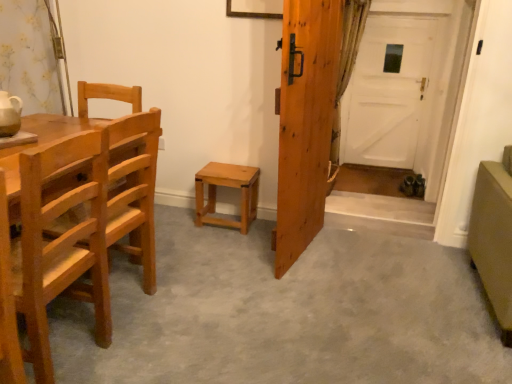
What do you see at coordinates (391, 89) in the screenshot?
I see `white matte door at center, arranged as the second door when viewed from the left` at bounding box center [391, 89].

What do you see at coordinates (305, 122) in the screenshot? The height and width of the screenshot is (384, 512). I see `wooden door at center, which is counted as the 1th door, starting from the left` at bounding box center [305, 122].

Image resolution: width=512 pixels, height=384 pixels. What are the coordinates of `green textured curtain at right` in the screenshot? It's located at coord(347,62).

In order to click on matte olive-green armchair at lower right in this screenshot , I will do `click(494, 237)`.

The height and width of the screenshot is (384, 512). Find the location of `white matte door at center, the first door viewed from the back`. white matte door at center, the first door viewed from the back is located at coordinates (391, 89).

Who is more distant, light brown wood stool at center or wooden door at center, which is counted as the 1th door, starting from the left?

light brown wood stool at center is more distant.

Is light brown wood stool at center shorter than wooden door at center, the 2th door when ordered from back to front?

Correct, light brown wood stool at center is not as tall as wooden door at center, the 2th door when ordered from back to front.

Measure the distance from light brown wood stool at center to wooden door at center, which is counted as the 1th door, starting from the left.

light brown wood stool at center and wooden door at center, which is counted as the 1th door, starting from the left, are 62.75 centimeters apart from each other.

Is light brown wood stool at center located outside wooden door at center, which appears as the 2th door when viewed from the right?

Yes.

Is light brown wood chair at left, the 2th chair viewed from the front, facing away from light brown wood chair at left, the 1th chair in the front-to-back sequence?

No, light brown wood chair at left, the 1th chair in the front-to-back sequence, is not at the back of light brown wood chair at left, the 2th chair viewed from the front.

Which object is closer to the camera taking this photo, light brown wood chair at left, the 2th chair viewed from the front, or light brown wood chair at left, the second chair when ordered from back to front?

light brown wood chair at left, the second chair when ordered from back to front, is more forward.

Can you confirm if light brown wood chair at left, which is counted as the 1th chair, starting from the back, is wider than light brown wood chair at left, the second chair when ordered from back to front?

Incorrect, the width of light brown wood chair at left, which is counted as the 1th chair, starting from the back, does not surpass that of light brown wood chair at left, the second chair when ordered from back to front.

Between light brown wood chair at left, which is counted as the 1th chair, starting from the back, and light brown wood chair at left, the second chair when ordered from back to front, which one appears on the left side from the viewer's perspective?

Positioned to the left is light brown wood chair at left, the second chair when ordered from back to front.

Is light brown wood chair at left, the 1th chair in the front-to-back sequence, oriented towards light brown wood stool at center?

No, light brown wood chair at left, the 1th chair in the front-to-back sequence, does not turn towards light brown wood stool at center.

Considering the relative sizes of light brown wood chair at left, the second chair when ordered from back to front, and light brown wood stool at center in the image provided, is light brown wood chair at left, the second chair when ordered from back to front, smaller than light brown wood stool at center?

No.

Is light brown wood chair at left, the 1th chair in the front-to-back sequence, closer to the viewer compared to light brown wood stool at center?

Yes, it is.

Considering the sizes of objects light brown wood chair at left, the 1th chair in the front-to-back sequence, and white matte door at center, positioned as the second door in front-to-back order, in the image provided, who is smaller, light brown wood chair at left, the 1th chair in the front-to-back sequence, or white matte door at center, positioned as the second door in front-to-back order,?

Smaller between the two is white matte door at center, positioned as the second door in front-to-back order.

Does point (100, 229) lie behind point (371, 50)?

That is False.

In the scene shown: Is light brown wood chair at left, the second chair when ordered from back to front, facing away from white matte door at center, positioned as the second door in front-to-back order?

No, light brown wood chair at left, the second chair when ordered from back to front, is not facing the opposite direction of white matte door at center, positioned as the second door in front-to-back order.

Is light brown wood chair at left, the 1th chair in the front-to-back sequence, inside or outside of white matte door at center, positioned as the second door in front-to-back order?

light brown wood chair at left, the 1th chair in the front-to-back sequence, cannot be found inside white matte door at center, positioned as the second door in front-to-back order.

Considering the relative sizes of green textured curtain at right and light brown wood stool at center in the image provided, is green textured curtain at right bigger than light brown wood stool at center?

Yes.

Measure the distance between green textured curtain at right and light brown wood stool at center.

green textured curtain at right is 5.39 feet away from light brown wood stool at center.

From a real-world perspective, who is located higher, green textured curtain at right or light brown wood stool at center?

green textured curtain at right, from a real-world perspective.

Consider the image. Is matte olive-green armchair at lower right further to camera compared to green textured curtain at right?

No, matte olive-green armchair at lower right is closer to the viewer.

From a real-world perspective, is matte olive-green armchair at lower right below green textured curtain at right?

Yes.

Who is bigger, matte olive-green armchair at lower right or green textured curtain at right?

With larger size is matte olive-green armchair at lower right.

Considering the relative sizes of light brown wood stool at center and light brown wood chair at left, which is counted as the 1th chair, starting from the back, in the image provided, is light brown wood stool at center thinner than light brown wood chair at left, which is counted as the 1th chair, starting from the back,?

Yes.

From a real-world perspective, which object stands above the other?

light brown wood chair at left, the 2th chair viewed from the front, from a real-world perspective.

Is light brown wood stool at center oriented away from light brown wood chair at left, which is counted as the 1th chair, starting from the back?

light brown wood stool at center is not turned away from light brown wood chair at left, which is counted as the 1th chair, starting from the back.

This screenshot has width=512, height=384. Find the location of `door that appears in front of the light brown wood stool at center`. door that appears in front of the light brown wood stool at center is located at coordinates pos(305,122).

At what (x,y) coordinates should I click in order to perform the action: click on chair lying on the left of light brown wood chair at left, the 2th chair viewed from the front. Please return your answer as a coordinate pair (x, y). The width and height of the screenshot is (512, 384). Looking at the image, I should click on (61, 244).

Looking at this image, based on their spatial positions, is white matte door at center, the first door viewed from the back, or light brown wood stool at center closer to wooden door at center, which appears as the 2th door when viewed from the right?

light brown wood stool at center lies closer to wooden door at center, which appears as the 2th door when viewed from the right, than the other object.

Looking at the image, which one is located closer to light brown wood chair at left, the second chair when ordered from back to front, white matte door at center, the 1th door viewed from the right, or matte olive-green armchair at lower right?

Among the two, matte olive-green armchair at lower right is located nearer to light brown wood chair at left, the second chair when ordered from back to front.

Looking at this image, when comparing their distances from light brown wood stool at center, does wooden door at center, the 2th door when ordered from back to front, or white matte door at center, the 1th door viewed from the right, seem closer?

wooden door at center, the 2th door when ordered from back to front, lies closer to light brown wood stool at center than the other object.

Looking at the image, which one is located closer to light brown wood chair at left, the 2th chair viewed from the front, green textured curtain at right or light brown wood stool at center?

Based on the image, light brown wood stool at center appears to be nearer to light brown wood chair at left, the 2th chair viewed from the front.

From the image, which object appears to be farther from light brown wood chair at left, the 1th chair in the front-to-back sequence, wooden door at center, the 2th door when ordered from back to front, or green textured curtain at right?

green textured curtain at right lies further to light brown wood chair at left, the 1th chair in the front-to-back sequence, than the other object.

Which object lies nearer to the anchor point wooden door at center, which appears as the 2th door when viewed from the right, green textured curtain at right or light brown wood chair at left, the 1th chair in the front-to-back sequence?

light brown wood chair at left, the 1th chair in the front-to-back sequence.

Based on their spatial positions, is light brown wood chair at left, the 2th chair viewed from the front, or wooden door at center, the 2th door when ordered from back to front, closer to white matte door at center, positioned as the second door in front-to-back order?

wooden door at center, the 2th door when ordered from back to front, is closer to white matte door at center, positioned as the second door in front-to-back order.

When comparing their distances from matte olive-green armchair at lower right, does green textured curtain at right or light brown wood chair at left, the 1th chair in the front-to-back sequence, seem further?

green textured curtain at right lies further to matte olive-green armchair at lower right than the other object.

Where is `stool between matte olive-green armchair at lower right and white matte door at center, the 1th door viewed from the right, from front to back`? This screenshot has width=512, height=384. stool between matte olive-green armchair at lower right and white matte door at center, the 1th door viewed from the right, from front to back is located at coordinates (227, 186).

You are a GUI agent. You are given a task and a screenshot of the screen. Output one action in this format:
    pyautogui.click(x=<x>, y=<y>)
    Task: Click on the armchair between light brown wood chair at left, the second chair when ordered from back to front, and green textured curtain at right, along the z-axis
    This screenshot has height=384, width=512.
    Given the screenshot: What is the action you would take?
    pyautogui.click(x=494, y=237)

Locate an element on the screen. door positioned between light brown wood chair at left, the 2th chair viewed from the front, and light brown wood stool at center from near to far is located at coordinates click(x=305, y=122).

This screenshot has height=384, width=512. I want to click on curtain located between light brown wood chair at left, which is counted as the 1th chair, starting from the back, and white matte door at center, the first door viewed from the back, in the depth direction, so click(347, 62).